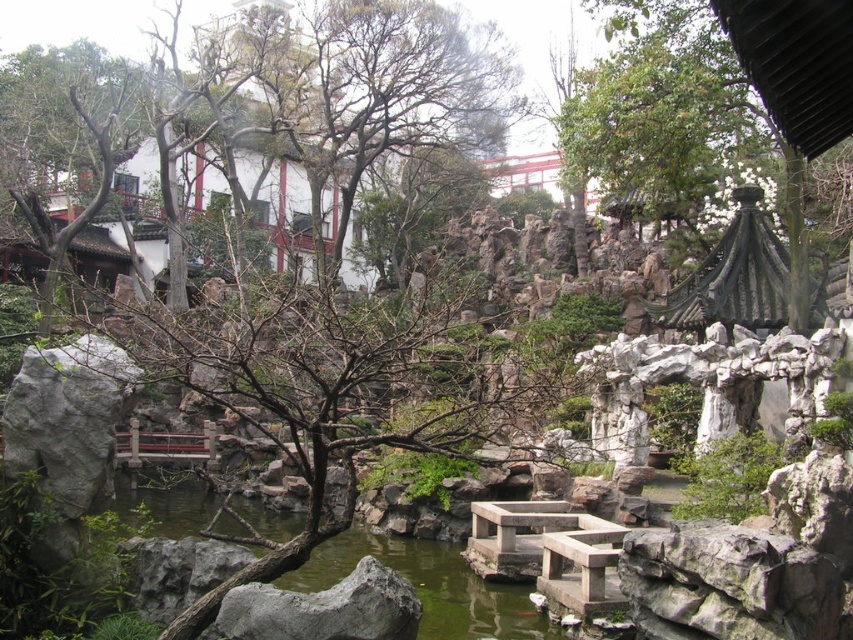
You are standing in the traditional Chinese garden and want to know which object is higher between the green leafy tree at upper center and the green stone water at center. Based on the scene description, can you determine which one is higher?

The green leafy tree at upper center is above the green stone water at center, so it is higher.

You are a visitor in the garden and want to take a photo of the green leafy tree at upper center and the green stone water at center. Which object will appear larger in the photo?

The green leafy tree at upper center will appear larger in the photo because it is taller than the green stone water at center.

You are a visitor in the garden and want to take a photo that includes both the green leafy tree at upper center and the green stone water at center. Which object should you position closer to the center of your photo to ensure both are clearly visible?

Since the green leafy tree at upper center is larger than the green stone water at center, you should position the green leafy tree at upper center closer to the center of your photo to ensure both are clearly visible.